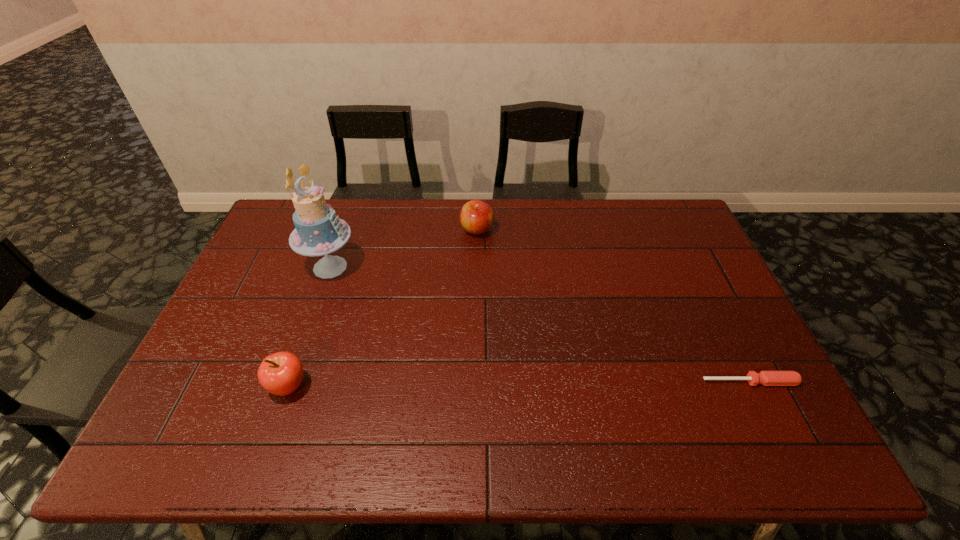
The width and height of the screenshot is (960, 540). In order to click on free space at the near edge in this screenshot , I will do `click(668, 395)`.

In the image, there is a desktop. Where is `vacant space at the left edge`? vacant space at the left edge is located at coordinates (256, 296).

In the image, there is a desktop. At what (x,y) coordinates should I click in order to perform the action: click on vacant region at the right edge. Please return your answer as a coordinate pair (x, y). Looking at the image, I should click on (709, 286).

In the image, there is a desktop. Where is `vacant space at the far left corner`? Image resolution: width=960 pixels, height=540 pixels. vacant space at the far left corner is located at coordinates pos(289,207).

The width and height of the screenshot is (960, 540). I want to click on vacant region at the near right corner, so click(752, 401).

Where is `free spot between the cake and the second object from right to left`? free spot between the cake and the second object from right to left is located at coordinates pyautogui.click(x=403, y=248).

Image resolution: width=960 pixels, height=540 pixels. What are the coordinates of `blank region between the farthest object and the screwdriver` in the screenshot? It's located at (613, 306).

I want to click on free space between the tallest object and the farther apple, so click(x=403, y=248).

The width and height of the screenshot is (960, 540). Find the location of `free area in between the third nearest object and the farthest object`. free area in between the third nearest object and the farthest object is located at coordinates (403, 248).

Locate an element on the screen. The height and width of the screenshot is (540, 960). free space between the second farthest object and the right apple is located at coordinates (403, 248).